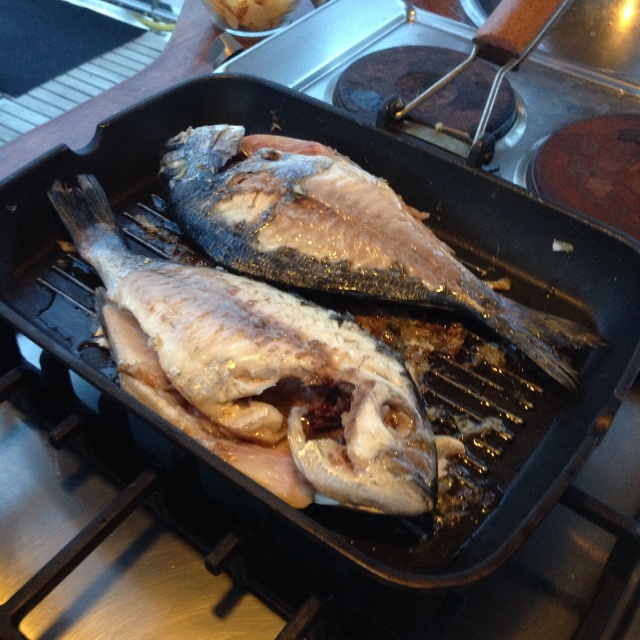
Question: Among these objects, which one is nearest to the camera?

Choices:
 (A) shiny silver fish at center
 (B) glistening silver fish at center

Answer: (A)

Question: Does shiny silver fish at center appear over glistening silver fish at center?

Choices:
 (A) no
 (B) yes

Answer: (A)

Question: Which of the following is the closest to the observer?

Choices:
 (A) glistening silver fish at center
 (B) shiny silver fish at center

Answer: (B)

Question: Observing the image, what is the correct spatial positioning of shiny silver fish at center in reference to glistening silver fish at center?

Choices:
 (A) above
 (B) below

Answer: (B)

Question: Does shiny silver fish at center appear on the right side of glistening silver fish at center?

Choices:
 (A) yes
 (B) no

Answer: (B)